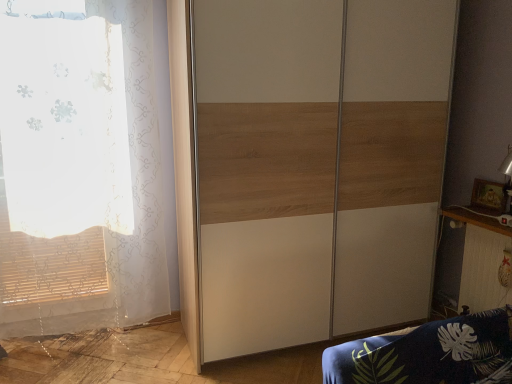
Question: From a real-world perspective, is wooden table at right on top of white sheer curtain at left?

Choices:
 (A) yes
 (B) no

Answer: (B)

Question: Is wooden table at right positioned beyond the bounds of white sheer curtain at left?

Choices:
 (A) yes
 (B) no

Answer: (A)

Question: Is wooden table at right looking in the opposite direction of white sheer curtain at left?

Choices:
 (A) no
 (B) yes

Answer: (A)

Question: Would you say white sheer curtain at left is part of wooden table at right's contents?

Choices:
 (A) yes
 (B) no

Answer: (B)

Question: Can you confirm if wooden table at right is bigger than white sheer curtain at left?

Choices:
 (A) yes
 (B) no

Answer: (B)

Question: From the image's perspective, relative to wooden table at right, is wooden/textured wardrobe at center above or below?

Choices:
 (A) above
 (B) below

Answer: (A)

Question: Do you think wooden/textured wardrobe at center is within wooden table at right, or outside of it?

Choices:
 (A) outside
 (B) inside

Answer: (A)

Question: Considering the positions of point (206, 354) and point (494, 238), is point (206, 354) closer or farther from the camera than point (494, 238)?

Choices:
 (A) farther
 (B) closer

Answer: (B)

Question: Is wooden/textured wardrobe at center taller or shorter than wooden table at right?

Choices:
 (A) tall
 (B) short

Answer: (A)

Question: Would you say wooden table at right is inside or outside white sheer curtain at left?

Choices:
 (A) inside
 (B) outside

Answer: (B)

Question: Is wooden table at right in front of or behind white sheer curtain at left in the image?

Choices:
 (A) behind
 (B) front

Answer: (A)

Question: Looking at their shapes, would you say wooden table at right is wider or thinner than white sheer curtain at left?

Choices:
 (A) thin
 (B) wide

Answer: (A)

Question: In terms of height, does wooden table at right look taller or shorter compared to white sheer curtain at left?

Choices:
 (A) short
 (B) tall

Answer: (A)

Question: In terms of size, does white sheer curtain at left appear bigger or smaller than wooden/textured wardrobe at center?

Choices:
 (A) small
 (B) big

Answer: (A)

Question: From the image's perspective, is white sheer curtain at left above or below wooden/textured wardrobe at center?

Choices:
 (A) above
 (B) below

Answer: (B)